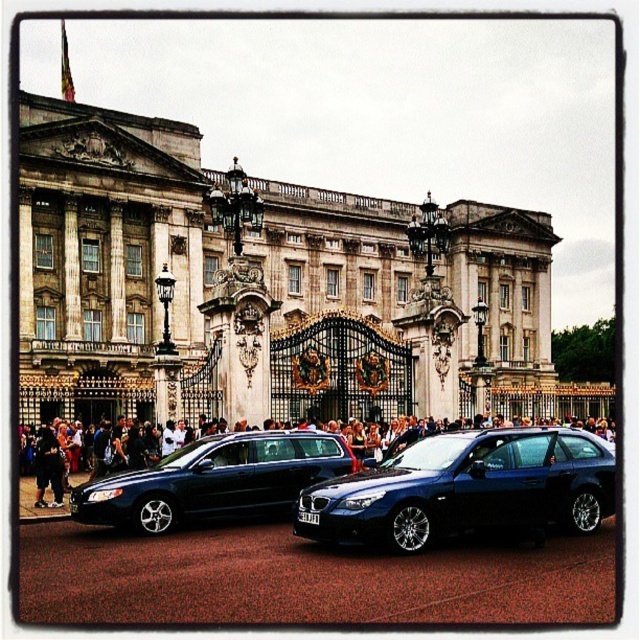
You are a photographer trying to capture a photo of the stone marble palace at center and the shiny blue car at center. Based on their sizes in the image, which one would appear taller in the photo?

The stone marble palace at center appears taller in the photo because it has a greater height compared to the shiny blue car at center.

You are standing at the central gate of the historic building and want to walk to the point marked by point (353, 477). Will you pass by point (202, 448) before reaching your destination?

Yes, because point (353, 477) is in front of point (202, 448), so you will pass by point (202, 448) first before reaching point (353, 477).

Looking at this image, you are a photographer standing in front of the Buckingham Palace scene. You want to take a photo that includes both the stone marble palace at center and the shiny blue car at center. Which object should you focus on first to ensure both are in frame?

The stone marble palace at center is above the shiny blue car at center, so you should focus on the shiny blue car at center first to ensure both are in frame.